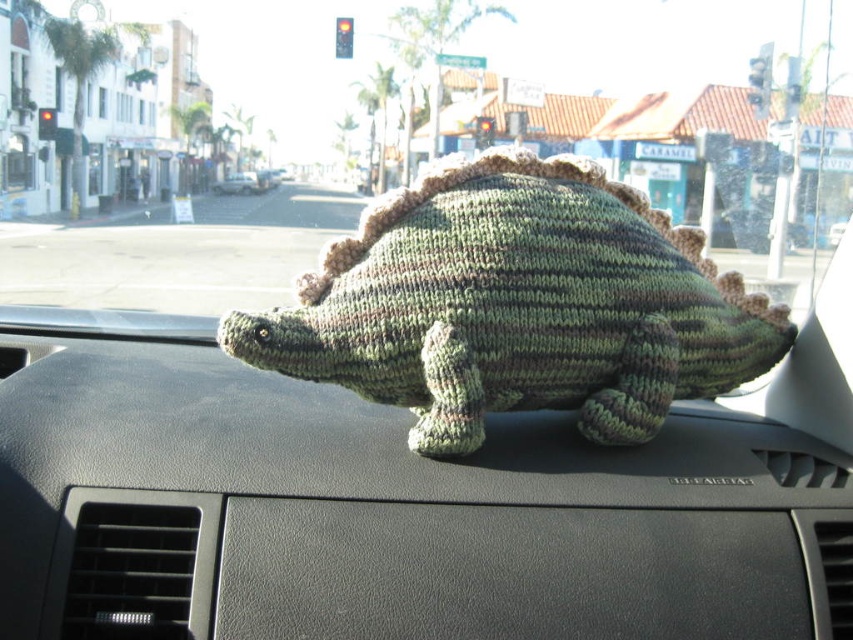
Does knitted green dinosaur at center have a larger size compared to green knitted dinosaur at center?

Actually, knitted green dinosaur at center might be smaller than green knitted dinosaur at center.

Does point (503, 237) come closer to viewer compared to point (254, 172)?

Yes, it is in front of point (254, 172).

Between point (329, 305) and point (250, 188), which one is positioned in front?

Point (329, 305) is in front.

Find the location of a particular element. The width and height of the screenshot is (853, 640). knitted green dinosaur at center is located at coordinates (517, 305).